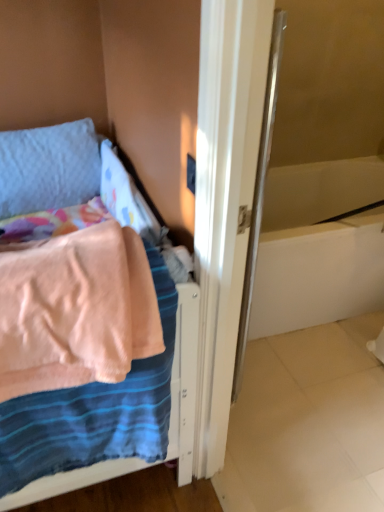
Question: From a real-world perspective, does white glossy bathtub at center right stand above pink fabric bed at left?

Choices:
 (A) yes
 (B) no

Answer: (B)

Question: Is white glossy bathtub at center right smaller than pink fabric bed at left?

Choices:
 (A) no
 (B) yes

Answer: (A)

Question: Is there a large distance between white glossy bathtub at center right and pink fabric bed at left?

Choices:
 (A) no
 (B) yes

Answer: (A)

Question: Is white glossy bathtub at center right further to the viewer compared to pink fabric bed at left?

Choices:
 (A) yes
 (B) no

Answer: (A)

Question: Is pink fabric bed at left completely or partially inside white glossy bathtub at center right?

Choices:
 (A) no
 (B) yes

Answer: (A)

Question: Relative to textured blue pillow at upper left, is white glossy bathtub at center right in front or behind?

Choices:
 (A) behind
 (B) front

Answer: (A)

Question: From a real-world perspective, relative to textured blue pillow at upper left, is white glossy bathtub at center right vertically above or below?

Choices:
 (A) above
 (B) below

Answer: (B)

Question: Based on their positions, is white glossy bathtub at center right located to the left or right of textured blue pillow at upper left?

Choices:
 (A) left
 (B) right

Answer: (B)

Question: In terms of size, does white glossy bathtub at center right appear bigger or smaller than textured blue pillow at upper left?

Choices:
 (A) big
 (B) small

Answer: (A)

Question: Considering their positions, is textured blue pillow at upper left located in front of or behind pink fabric bed at left?

Choices:
 (A) front
 (B) behind

Answer: (B)

Question: Is textured blue pillow at upper left inside the boundaries of pink fabric bed at left, or outside?

Choices:
 (A) inside
 (B) outside

Answer: (B)

Question: Considering the positions of textured blue pillow at upper left and pink fabric bed at left in the image, is textured blue pillow at upper left wider or thinner than pink fabric bed at left?

Choices:
 (A) wide
 (B) thin

Answer: (B)

Question: Looking at the image, does textured blue pillow at upper left seem bigger or smaller compared to pink fabric bed at left?

Choices:
 (A) small
 (B) big

Answer: (A)

Question: In terms of size, does pink fabric bed at left appear bigger or smaller than textured blue pillow at upper left?

Choices:
 (A) big
 (B) small

Answer: (A)

Question: Is pink fabric bed at left in front of or behind textured blue pillow at upper left in the image?

Choices:
 (A) behind
 (B) front

Answer: (B)